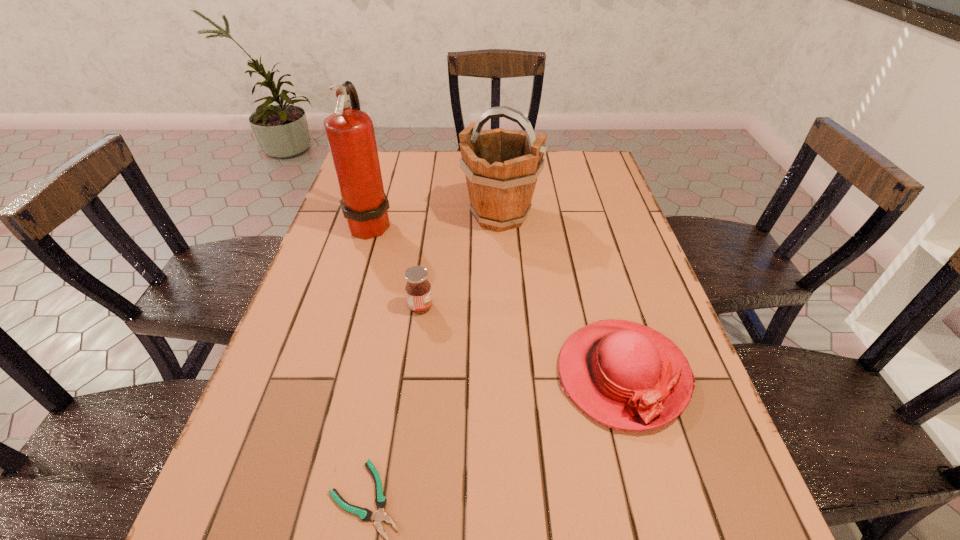
Locate an element on the screen. This screenshot has height=540, width=960. empty space that is in between the tallest object and the jam is located at coordinates (396, 265).

Locate an element on the screen. free space between the second nearest object and the fourth shortest object is located at coordinates (561, 295).

Identify the location of empty space that is in between the hat and the third nearest object. The width and height of the screenshot is (960, 540). (521, 341).

Locate which object ranks in proximity to the jam. Please provide its 2D coordinates. Your answer should be formatted as a tuple, i.e. [(x, y)], where the tuple contains the x and y coordinates of a point satisfying the conditions above.

[(350, 133)]

The width and height of the screenshot is (960, 540). In order to click on the fourth closest object to the hat in this screenshot , I will do `click(350, 133)`.